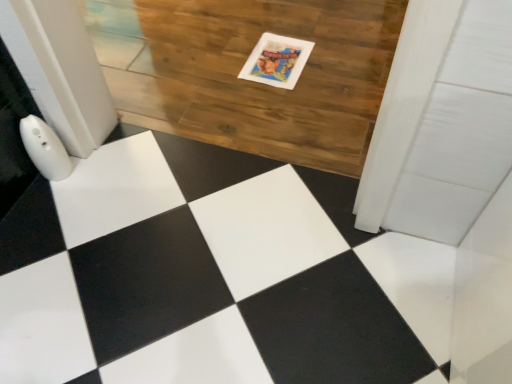
The height and width of the screenshot is (384, 512). I want to click on free location to the right of matte paper postcard at upper center, so click(337, 59).